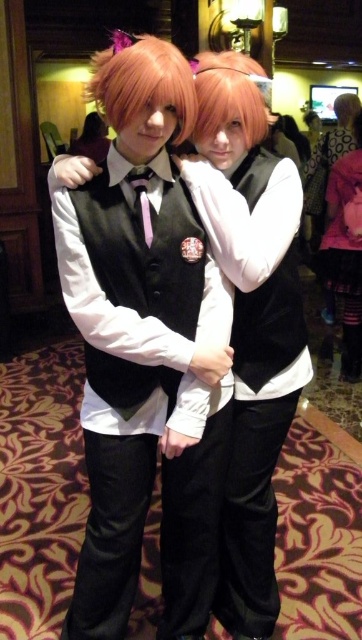
You are a photographer positioned in front of the two individuals. You notice the pink fabric dress at lower right and the blonde hair at center. Which of these two items is positioned farther to the right?

The pink fabric dress at lower right is positioned farther to the right than the blonde hair at center.

You are a photographer setting up for an event. You need to position a pink fabric dress at lower right and a matte purple tie at center in the frame. Given their sizes, which object should you adjust to ensure both fit comfortably in the photo without overcrowding?

The pink fabric dress at lower right is bigger than the matte purple tie at center, so you should adjust the positioning of the pink fabric dress at lower right to ensure it doesn